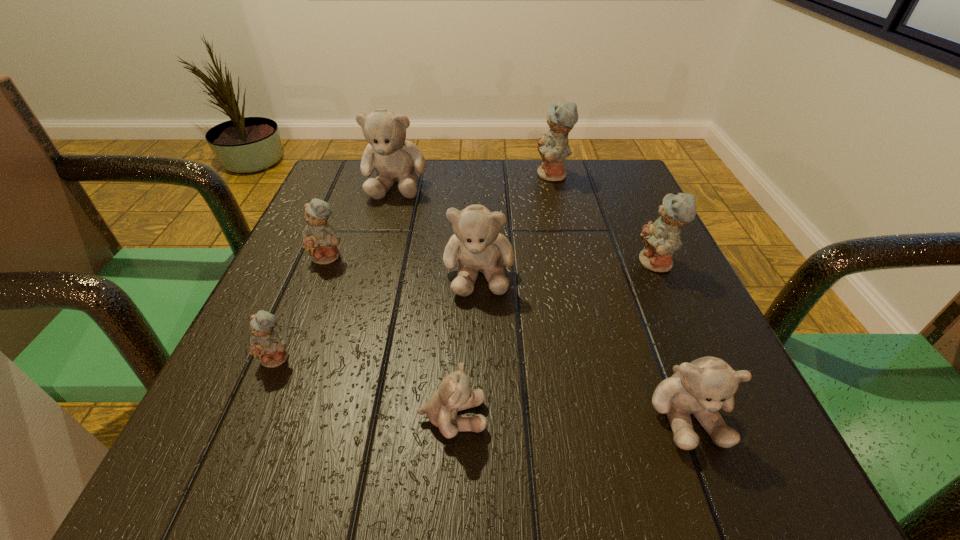
Where is `the biggest blue teddy bear`? the biggest blue teddy bear is located at coordinates (553, 148).

This screenshot has height=540, width=960. What are the coordinates of `the farthest blue teddy bear` in the screenshot? It's located at (553, 148).

Where is `the farthest gray teddy bear`? the farthest gray teddy bear is located at coordinates (395, 159).

Identify the location of the biggest gray teddy bear. Image resolution: width=960 pixels, height=540 pixels. (395, 159).

The image size is (960, 540). Identify the location of the rightmost blue teddy bear. (660, 239).

In order to click on the second biggest gray teddy bear in this screenshot , I will do `click(477, 244)`.

You are a GUI agent. You are given a task and a screenshot of the screen. Output one action in this format:
    pyautogui.click(x=<x>, y=<y>)
    Task: Click on the second smallest blue teddy bear
    
    Given the screenshot: What is the action you would take?
    pyautogui.click(x=320, y=241)

You are a GUI agent. You are given a task and a screenshot of the screen. Output one action in this format:
    pyautogui.click(x=<x>, y=<y>)
    Task: Click on the third biggest gray teddy bear
    
    Given the screenshot: What is the action you would take?
    point(702,387)

The height and width of the screenshot is (540, 960). I want to click on the smallest blue teddy bear, so click(x=267, y=346).

Find the location of `the third nearest object`. the third nearest object is located at coordinates (267, 346).